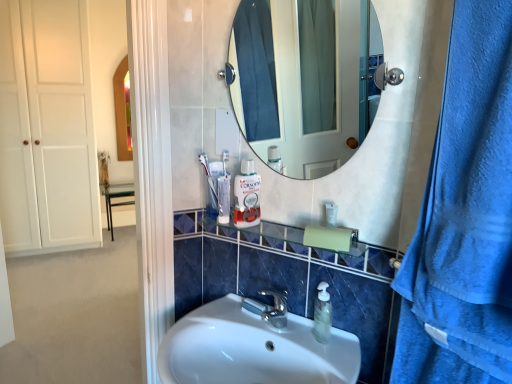
Question: Can you confirm if clear glass shelf at center is positioned to the left of white glossy sink at center?

Choices:
 (A) no
 (B) yes

Answer: (A)

Question: Does clear glass shelf at center come in front of white glossy sink at center?

Choices:
 (A) yes
 (B) no

Answer: (B)

Question: From the image's perspective, is clear glass shelf at center under white glossy sink at center?

Choices:
 (A) yes
 (B) no

Answer: (B)

Question: Considering the relative sizes of clear glass shelf at center and white glossy sink at center in the image provided, is clear glass shelf at center taller than white glossy sink at center?

Choices:
 (A) yes
 (B) no

Answer: (B)

Question: Is white glossy sink at center a part of clear glass shelf at center?

Choices:
 (A) no
 (B) yes

Answer: (A)

Question: Is point (454, 206) positioned closer to the camera than point (184, 340)?

Choices:
 (A) farther
 (B) closer

Answer: (B)

Question: Considering the positions of blue terry cloth towel at right and white glossy sink at center in the image, is blue terry cloth towel at right bigger or smaller than white glossy sink at center?

Choices:
 (A) big
 (B) small

Answer: (B)

Question: Is blue terry cloth towel at right taller or shorter than white glossy sink at center?

Choices:
 (A) tall
 (B) short

Answer: (A)

Question: Relative to white glossy sink at center, is blue terry cloth towel at right in front or behind?

Choices:
 (A) behind
 (B) front

Answer: (B)

Question: In terms of size, does blue textured towel at right appear bigger or smaller than white glossy sink at center?

Choices:
 (A) small
 (B) big

Answer: (A)

Question: From a real-world perspective, is blue textured towel at right positioned above or below white glossy sink at center?

Choices:
 (A) below
 (B) above

Answer: (B)

Question: Considering the positions of blue textured towel at right and white glossy sink at center in the image, is blue textured towel at right wider or thinner than white glossy sink at center?

Choices:
 (A) wide
 (B) thin

Answer: (B)

Question: Considering their positions, is blue textured towel at right located in front of or behind white glossy sink at center?

Choices:
 (A) front
 (B) behind

Answer: (A)

Question: From a real-world perspective, is white glossy mouthwash at center above or below clear glass shelf at center?

Choices:
 (A) above
 (B) below

Answer: (A)

Question: Considering their positions, is white glossy mouthwash at center located in front of or behind clear glass shelf at center?

Choices:
 (A) front
 (B) behind

Answer: (B)